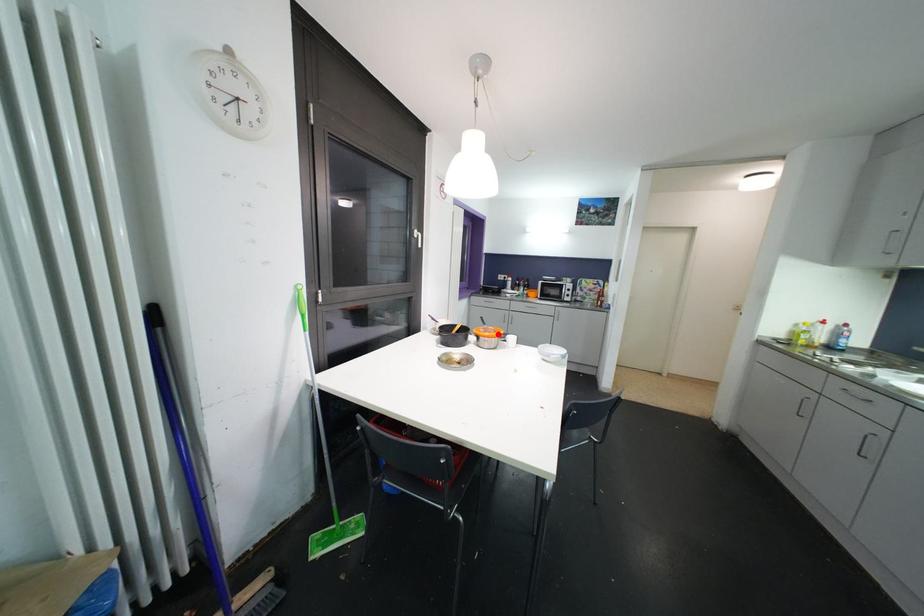
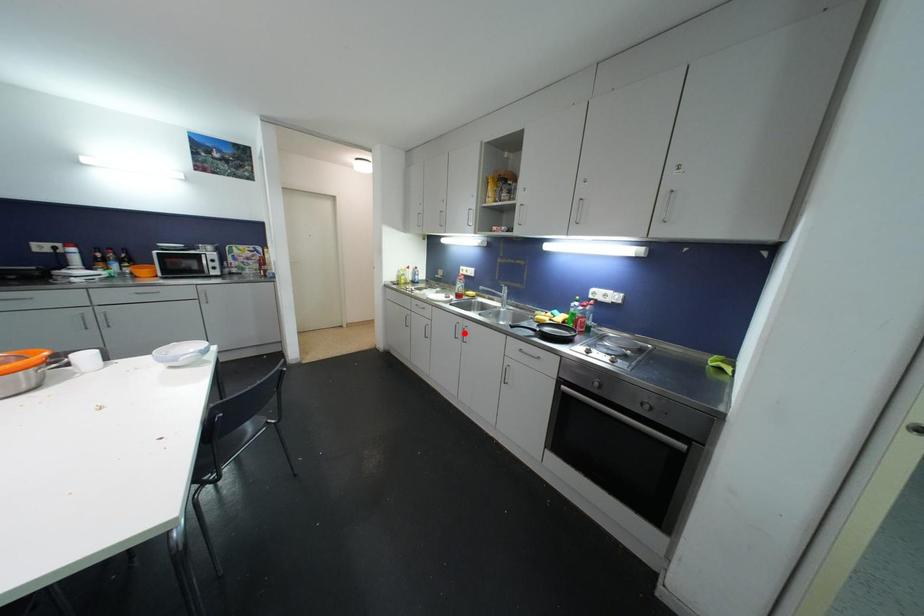
I am providing you with two images of the same scene from different viewpoints. A red point is marked on the first image and another point is marked on the second image. Is the marked point in image1 the same physical position as the marked point in image2?

No